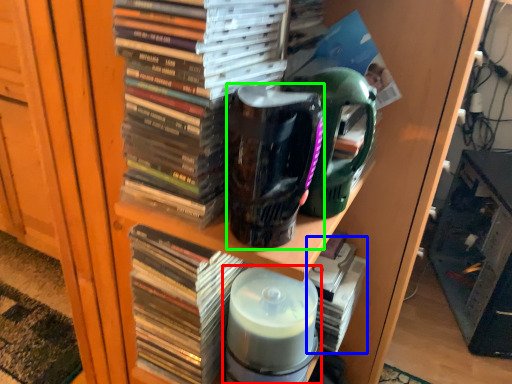
Question: Based on their relative distances, which object is nearer to bottle (highlighted by a red box)? Choose from book (highlighted by a blue box) and mug (highlighted by a green box).

Choices:
 (A) book
 (B) mug

Answer: (A)